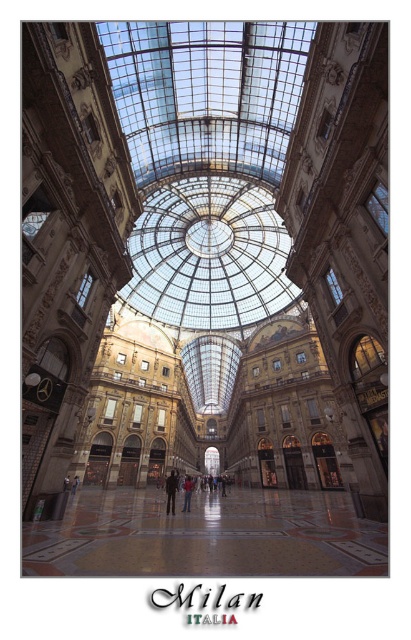
From the picture: You are a visitor in the shopping arcade and notice a red fabric jacket at center and a transparent glass dome at center. Which object is closer to you when you are facing the entrance?

The transparent glass dome at center is closer to you because the red fabric jacket at center is behind it.

Looking at this image, you are a visitor in the shopping arcade and you see a dark brown leather jacket at center and a polished marble floor at center. Which object is located more to the right side?

The polished marble floor at center is positioned on the right side of the dark brown leather jacket at center, so the polished marble floor at center is more to the right side.

You are standing in the shopping arcade and notice both the transparent glass dome at center and the red fabric jacket at center. From your current position, which object is positioned to the left?

The red fabric jacket at center is positioned to the left of the transparent glass dome at center.